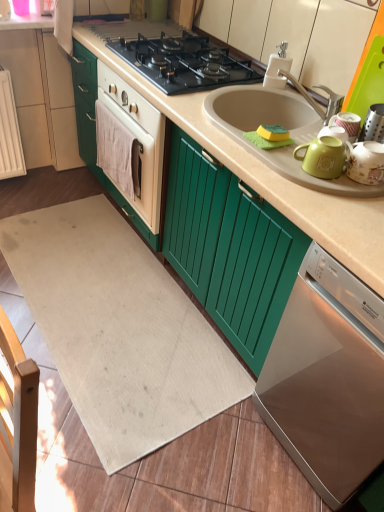
Question: Considering the positions of satin silver dishwasher at lower right and white plastic faucet at upper right in the image, is satin silver dishwasher at lower right wider or thinner than white plastic faucet at upper right?

Choices:
 (A) thin
 (B) wide

Answer: (B)

Question: From a real-world perspective, is satin silver dishwasher at lower right above or below white plastic faucet at upper right?

Choices:
 (A) below
 (B) above

Answer: (A)

Question: Which object is the farthest from the white cloth towel at center?

Choices:
 (A) beige carpet at lower left
 (B) matte ceramic mug at upper right
 (C) satin silver dishwasher at lower right
 (D) beige matte countertop at center
 (E) matte green tea pot at right

Answer: (C)

Question: Estimate the real-world distances between objects in this image. Which object is farther from the matte green tea pot at right?

Choices:
 (A) black matte gas stove at center
 (B) white plastic faucet at upper right
 (C) white cloth towel at center
 (D) matte ceramic mug at upper right
 (E) beige matte countertop at center

Answer: (C)